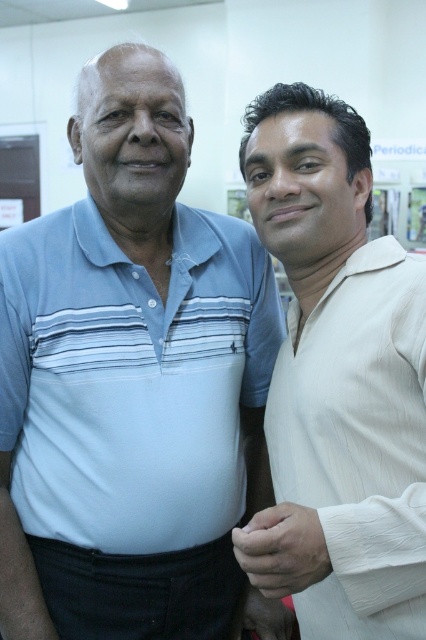
Question: Can you confirm if light blue striped polo shirt at left is wider than white silk shirt at right?

Choices:
 (A) yes
 (B) no

Answer: (A)

Question: Is light blue striped polo shirt at left wider than white silk shirt at right?

Choices:
 (A) yes
 (B) no

Answer: (A)

Question: Does light blue striped polo shirt at left appear on the right side of white silk shirt at right?

Choices:
 (A) no
 (B) yes

Answer: (A)

Question: Which of the following is the closest to the observer?

Choices:
 (A) light blue striped polo shirt at left
 (B) white silk shirt at right

Answer: (B)

Question: Which object appears farthest from the camera in this image?

Choices:
 (A) white silk shirt at right
 (B) light blue striped polo shirt at left

Answer: (B)

Question: Among these points, which one is nearest to the camera?

Choices:
 (A) pos(180,273)
 (B) pos(400,340)

Answer: (B)